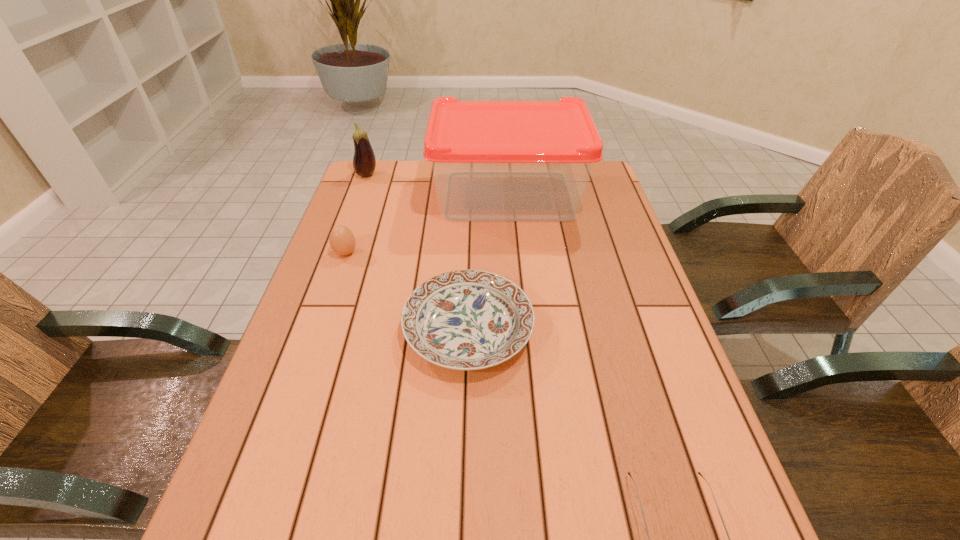
In order to click on eggplant that is at the far edge in this screenshot , I will do `click(364, 162)`.

Locate an element on the screen. The width and height of the screenshot is (960, 540). eggplant positioned at the left edge is located at coordinates (364, 162).

Where is `boiled egg that is at the left edge`? The height and width of the screenshot is (540, 960). boiled egg that is at the left edge is located at coordinates (342, 241).

The image size is (960, 540). Find the location of `object at the right edge`. object at the right edge is located at coordinates (492, 160).

Where is `object present at the far left corner`? object present at the far left corner is located at coordinates (364, 162).

Where is `object that is at the far right corner`? The image size is (960, 540). object that is at the far right corner is located at coordinates (492, 160).

The height and width of the screenshot is (540, 960). In the image, there is a desktop. Find the location of `vacant area at the far edge`. vacant area at the far edge is located at coordinates (414, 171).

The image size is (960, 540). What are the coordinates of `vacant space at the left edge of the desktop` in the screenshot? It's located at (328, 336).

You are a GUI agent. You are given a task and a screenshot of the screen. Output one action in this format:
    pyautogui.click(x=<x>, y=<y>)
    Task: Click on the free space at the right edge of the desktop
    
    Given the screenshot: What is the action you would take?
    pyautogui.click(x=629, y=240)

Locate an element on the screen. vacant point at the far left corner is located at coordinates (375, 174).